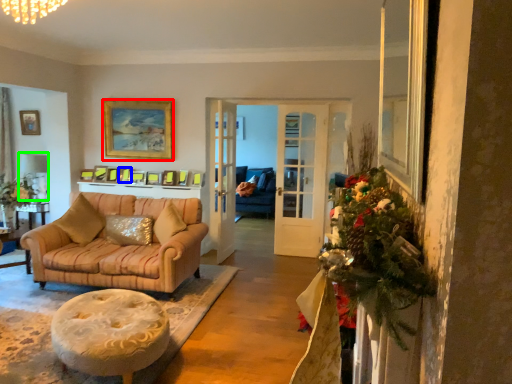
Question: Estimate the real-world distances between objects in this image. Which object is closer to picture frame (highlighted by a red box), picture frame (highlighted by a blue box) or lamp (highlighted by a green box)?

Choices:
 (A) picture frame
 (B) lamp

Answer: (A)